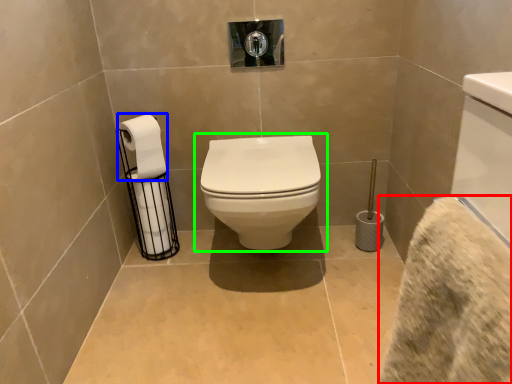
Question: Which object is the farthest from bath towel (highlighted by a red box)? Choose among these: toilet paper (highlighted by a blue box) or toilet (highlighted by a green box).

Choices:
 (A) toilet paper
 (B) toilet

Answer: (A)